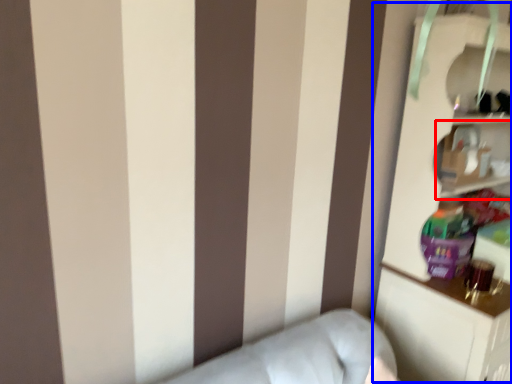
Question: Which of the following is the farthest to the observer, cabinet (highlighted by a red box) or bookcase (highlighted by a blue box)?

Choices:
 (A) cabinet
 (B) bookcase

Answer: (A)